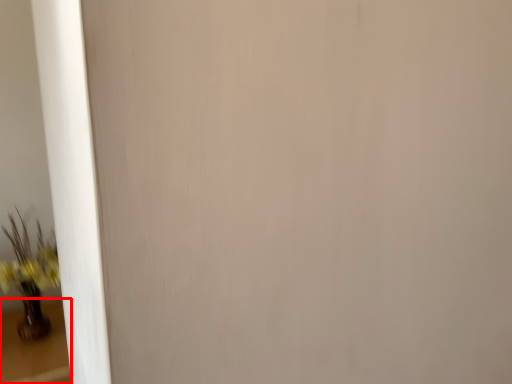
Question: From the image's perspective, considering the relative positions of table (annotated by the red box) and houseplant in the image provided, where is table (annotated by the red box) located with respect to the staircase?

Choices:
 (A) above
 (B) below

Answer: (B)